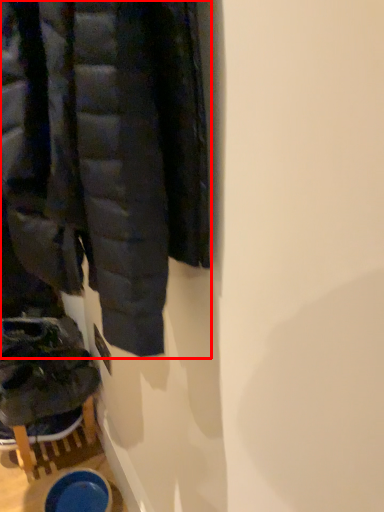
Question: From the image's perspective, what is the correct spatial positioning of jacket (annotated by the red box) in reference to footwear?

Choices:
 (A) below
 (B) above

Answer: (B)